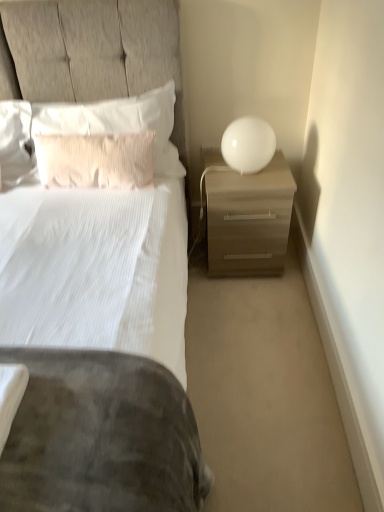
Question: From a real-world perspective, relative to pink textured pillow at upper left, which ranks as the first pillow in bottom-to-top order, is white textured pillow at upper left, positioned as the first pillow in top-to-bottom order, vertically above or below?

Choices:
 (A) below
 (B) above

Answer: (B)

Question: Visually, is white textured pillow at upper left, positioned as the second pillow in bottom-to-top order, positioned to the left or to the right of pink textured pillow at upper left, which is the second pillow in top-to-bottom order?

Choices:
 (A) left
 (B) right

Answer: (B)

Question: Which object is positioned farthest from the pink textured pillow at upper left, which is the second pillow in top-to-bottom order?

Choices:
 (A) white glossy sphere at upper right
 (B) matte wood nightstand at right
 (C) white textured pillow at upper left, positioned as the first pillow in top-to-bottom order

Answer: (A)

Question: Considering the real-world distances, which object is farthest from the white textured pillow at upper left, positioned as the first pillow in top-to-bottom order?

Choices:
 (A) pink textured pillow at upper left, which ranks as the first pillow in bottom-to-top order
 (B) matte wood nightstand at right
 (C) white glossy sphere at upper right

Answer: (B)